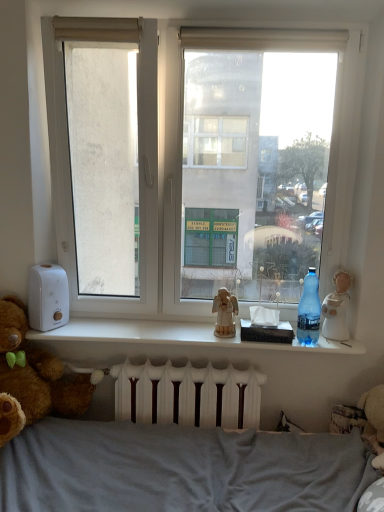
Question: Is blue plastic bottle at right further to the viewer compared to white ceramic figurine at right, the first figurine viewed from the right?

Choices:
 (A) no
 (B) yes

Answer: (A)

Question: Is blue plastic bottle at right closer to the viewer compared to white ceramic figurine at right, the first figurine viewed from the right?

Choices:
 (A) yes
 (B) no

Answer: (A)

Question: Does blue plastic bottle at right touch white ceramic figurine at right, which is the second figurine from left to right?

Choices:
 (A) yes
 (B) no

Answer: (B)

Question: Does blue plastic bottle at right have a lesser width compared to white ceramic figurine at right, the first figurine viewed from the right?

Choices:
 (A) no
 (B) yes

Answer: (B)

Question: Can you confirm if blue plastic bottle at right is wider than white ceramic figurine at right, which is the second figurine from left to right?

Choices:
 (A) no
 (B) yes

Answer: (A)

Question: Does point (344, 32) appear closer or farther from the camera than point (344, 318)?

Choices:
 (A) closer
 (B) farther

Answer: (A)

Question: Looking at the image, does white fabric curtain at upper center seem bigger or smaller compared to white ceramic figurine at right, the first figurine viewed from the right?

Choices:
 (A) big
 (B) small

Answer: (B)

Question: Is white fabric curtain at upper center in front of or behind white ceramic figurine at right, which is the second figurine from left to right, in the image?

Choices:
 (A) behind
 (B) front

Answer: (B)

Question: Would you say white fabric curtain at upper center is to the left or to the right of white ceramic figurine at right, which is the second figurine from left to right, in the picture?

Choices:
 (A) left
 (B) right

Answer: (A)

Question: In the image, is blue plastic bottle at right on the left side or the right side of wooden angel at center, the second figurine from the right?

Choices:
 (A) right
 (B) left

Answer: (A)

Question: Is point (311, 313) positioned closer to the camera than point (235, 300)?

Choices:
 (A) closer
 (B) farther

Answer: (A)

Question: Which is correct: blue plastic bottle at right is inside wooden angel at center, arranged as the first figurine when viewed from the left, or outside of it?

Choices:
 (A) outside
 (B) inside

Answer: (A)

Question: From a real-world perspective, is blue plastic bottle at right above or below wooden angel at center, the second figurine from the right?

Choices:
 (A) below
 (B) above

Answer: (B)

Question: Looking at their shapes, would you say white matte window sill at center is wider or thinner than white fabric curtain at upper center?

Choices:
 (A) wide
 (B) thin

Answer: (A)

Question: Is point (150, 333) positioned closer to the camera than point (231, 44)?

Choices:
 (A) farther
 (B) closer

Answer: (A)